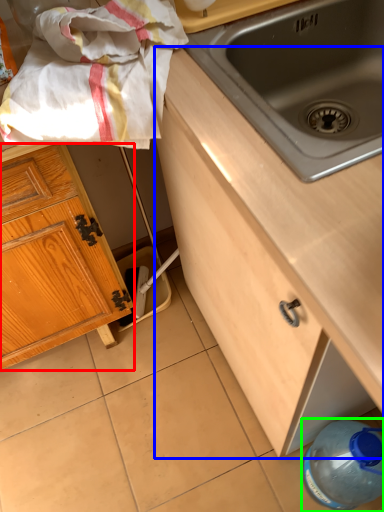
Question: Considering the real-world distances, which object is farthest from cabinetry (highlighted by a red box)? cabinetry (highlighted by a blue box) or bottle (highlighted by a green box)?

Choices:
 (A) cabinetry
 (B) bottle

Answer: (B)